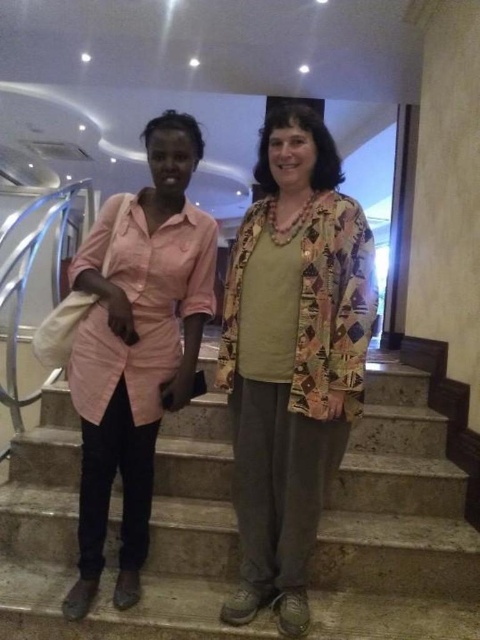
Who is positioned more to the left, pink cotton shirt at left or pink fabric shirt at center?

Positioned to the left is pink fabric shirt at center.

From the picture: Is pink cotton shirt at left above pink fabric shirt at center?

Incorrect, pink cotton shirt at left is not positioned above pink fabric shirt at center.

Find the location of a particular element. pink cotton shirt at left is located at coordinates (291, 356).

Based on the photo, who is lower down, gray concrete stairs at center or pink cotton shirt at left?

gray concrete stairs at center

Is gray concrete stairs at center positioned before pink cotton shirt at left?

No.

Which is behind, point (205, 624) or point (259, 536)?

The point (259, 536) is behind.

Where is `gray concrete stairs at center`? gray concrete stairs at center is located at coordinates (118, 531).

Describe the element at coordinates (118, 531) in the screenshot. I see `gray concrete stairs at center` at that location.

Does gray concrete stairs at center appear over pink fabric shirt at center?

Actually, gray concrete stairs at center is below pink fabric shirt at center.

Between point (370, 435) and point (156, 356), which one is positioned in front?

Point (156, 356) is more forward.

At what (x,y) coordinates should I click in order to perform the action: click on gray concrete stairs at center. Please return your answer as a coordinate pair (x, y). Image resolution: width=480 pixels, height=640 pixels. Looking at the image, I should click on (118, 531).